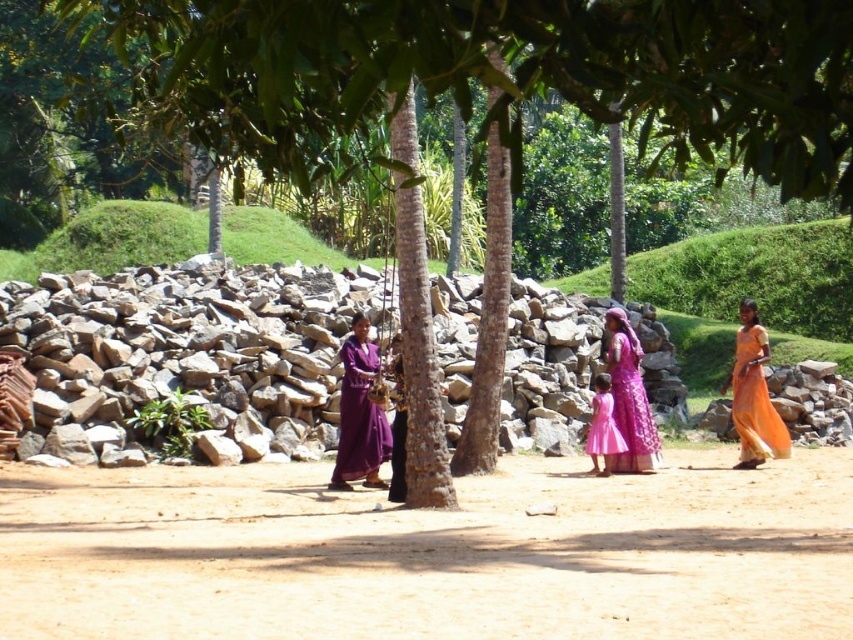
Which is in front, point (370, 451) or point (624, 440)?

Point (370, 451) is in front.

Does purple silk robe at center have a larger size compared to pink satin dress at center?

Yes.

In the scene shown: Who is more distant from viewer, (347,358) or (606,442)?

The point (606,442) is more distant.

Find the location of a particular element. purple silk robe at center is located at coordinates (358, 417).

Who is more forward, (x=288, y=634) or (x=387, y=458)?

Point (x=288, y=634)

Does brown sandy soil at center come in front of purple silk robe at center?

Yes.

Which is behind, point (28, 531) or point (358, 365)?

Positioned behind is point (358, 365).

You are a GUI agent. You are given a task and a screenshot of the screen. Output one action in this format:
    pyautogui.click(x=<x>, y=<y>)
    Task: Click on the brown sandy soil at center
    
    Given the screenshot: What is the action you would take?
    pyautogui.click(x=430, y=554)

Which is more to the right, brown sandy soil at center or pink satin dress at center?

From the viewer's perspective, pink satin dress at center appears more on the right side.

Who is positioned more to the left, brown sandy soil at center or pink satin dress at center?

Positioned to the left is brown sandy soil at center.

Between point (792, 596) and point (593, 420), which one is positioned in front?

Positioned in front is point (792, 596).

Locate an element on the screen. brown sandy soil at center is located at coordinates pos(430,554).